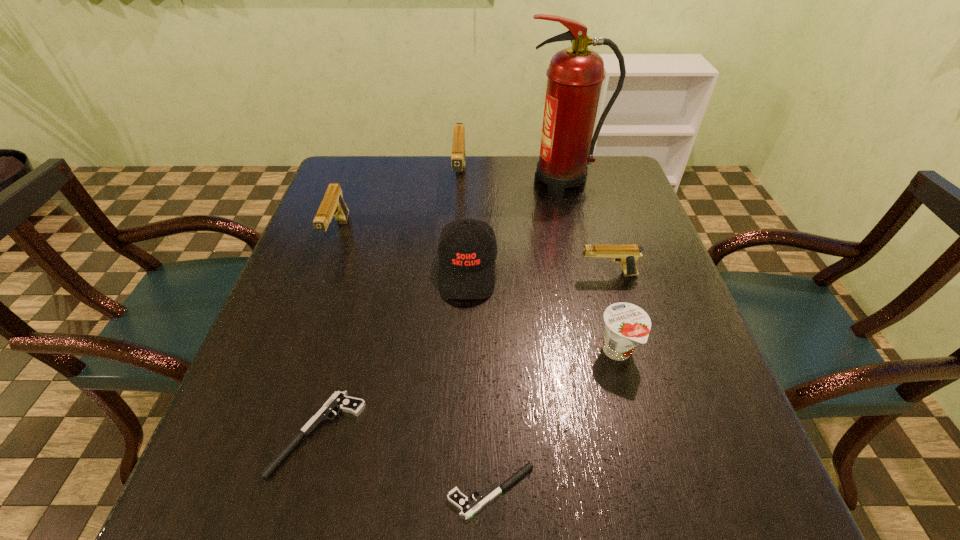
What are the coordinates of `object that stands as the seventh closest to the yogurt` in the screenshot? It's located at (333, 205).

At what (x,y) coordinates should I click in order to perform the action: click on the fourth closest object relative to the shortest object. Please return your answer as a coordinate pair (x, y). Image resolution: width=960 pixels, height=540 pixels. Looking at the image, I should click on [x=627, y=254].

I want to click on pistol object that ranks as the closest to the second nearest tan pistol, so click(x=458, y=160).

Image resolution: width=960 pixels, height=540 pixels. What are the coordinates of `the closest pistol to the bigger black pistol` in the screenshot? It's located at (468, 508).

At what (x,y) coordinates should I click in order to perform the action: click on tan pistol that can be found as the third closest to the bigger black pistol. Please return your answer as a coordinate pair (x, y). This screenshot has height=540, width=960. Looking at the image, I should click on tap(458, 160).

Locate which tan pistol is the closest to the second object from left to right. Please provide its 2D coordinates. Your answer should be formatted as a tuple, i.e. [(x, y)], where the tuple contains the x and y coordinates of a point satisfying the conditions above.

[(333, 205)]

Where is `vacant region that satisfies the following two spatial constraints: 1. at the barrel of the sixth farthest object; 2. on the right side of the second tan pistol from left to right`? vacant region that satisfies the following two spatial constraints: 1. at the barrel of the sixth farthest object; 2. on the right side of the second tan pistol from left to right is located at coordinates (450, 352).

Identify the location of free space that satisfies the following two spatial constraints: 1. at the barrel of the third nearest object; 2. on the right side of the biggest tan pistol. Image resolution: width=960 pixels, height=540 pixels. (450, 352).